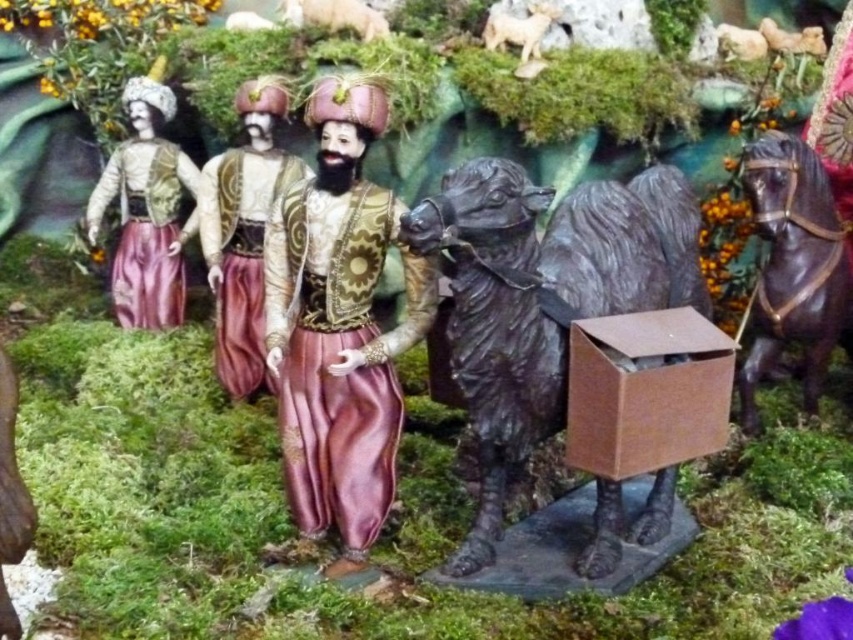
In the diorama scene, there is a shiny gold vest at center and a brown fuzzy goat at upper right. From the perspective of someone standing in front of the diorama, which object is positioned to the left of the other?

The shiny gold vest at center is to the left of the brown fuzzy goat at upper right.

You are an artist creating a painting of this scene. You need to ensure the proportions of the shiny gold vest at center and the brown fuzzy goat at upper right are accurate. Which object should you make wider in your painting?

The shiny gold vest at center should be made wider in the painting since its width is larger than the brown fuzzy goat at upper right.

You are standing in front of the diorama and want to place a small decoration exactly at the point marked as point [265,308]. If your hand can reach up to 1 meter, will you be able to reach that point?

The point [265,308] is 1.10 meters away from the viewer, which is beyond the 1 meter reach of your hand. Therefore, you won